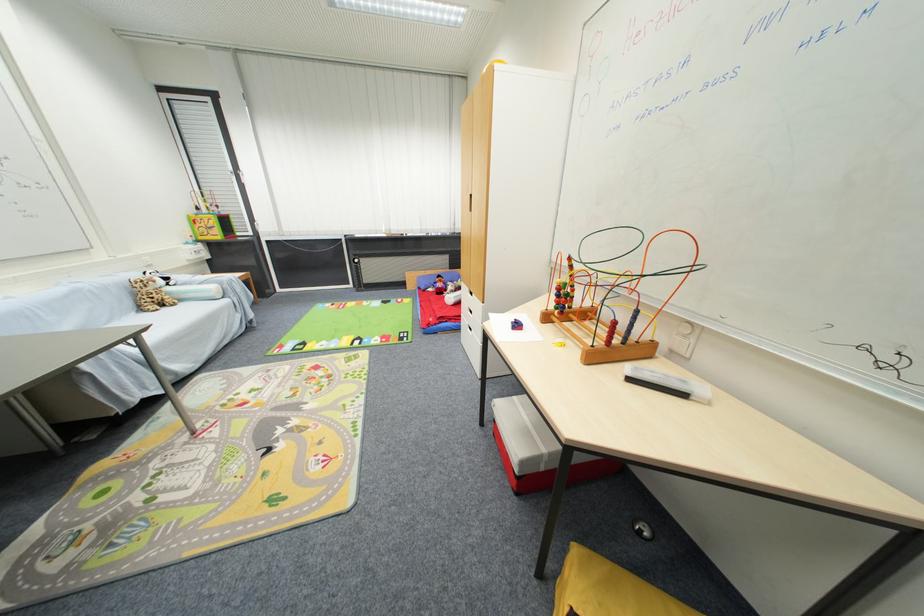
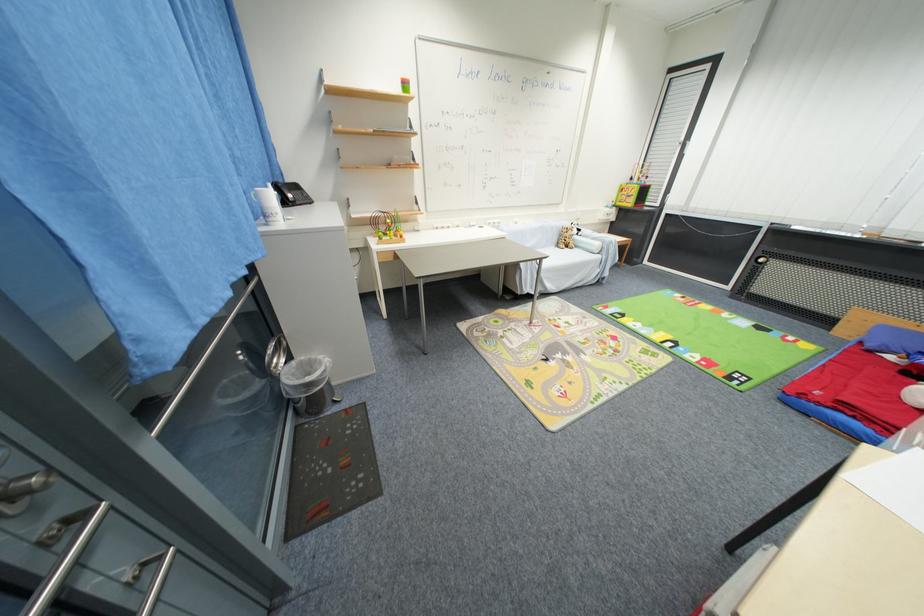
Where in the second image is the point corresponding to point 232,302 from the first image?

(603, 259)